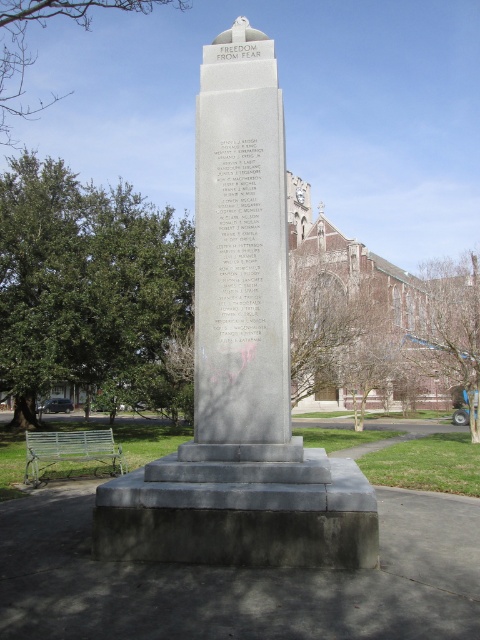
Question: Which point appears closest to the camera in this image?

Choices:
 (A) (35, 449)
 (B) (121, 538)

Answer: (B)

Question: Is gray stone monument at center wider than gray polished stone monument at center?

Choices:
 (A) yes
 (B) no

Answer: (B)

Question: Considering the relative positions of gray polished stone monument at center and green painted wood park bench at lower left in the image provided, where is gray polished stone monument at center located with respect to green painted wood park bench at lower left?

Choices:
 (A) below
 (B) above

Answer: (B)

Question: Which is farther from the green painted wood park bench at lower left?

Choices:
 (A) gray polished stone monument at center
 (B) gray stone monument at center

Answer: (A)

Question: Does gray polished stone monument at center have a lesser width compared to green painted wood park bench at lower left?

Choices:
 (A) yes
 (B) no

Answer: (A)

Question: Estimate the real-world distances between objects in this image. Which object is closer to the gray polished stone monument at center?

Choices:
 (A) green painted wood park bench at lower left
 (B) gray stone monument at center

Answer: (B)